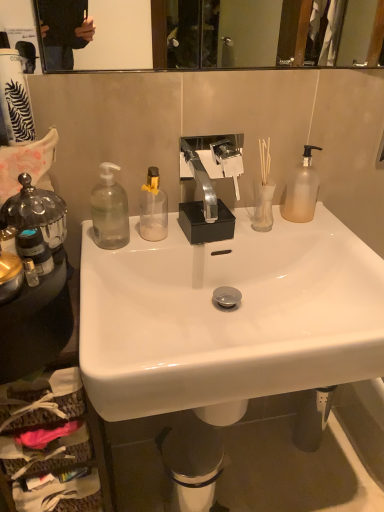
Measure the distance between transparent glass bottle at center, which ranks as the second bottle in right-to-left order, and camera.

34.86 inches.

The width and height of the screenshot is (384, 512). What do you see at coordinates (153, 208) in the screenshot? I see `transparent glass bottle at center, which ranks as the second bottle in right-to-left order` at bounding box center [153, 208].

What do you see at coordinates (227, 316) in the screenshot? This screenshot has height=512, width=384. I see `white glossy sink at center` at bounding box center [227, 316].

Where is `white matte toilet paper at upper left`? The width and height of the screenshot is (384, 512). white matte toilet paper at upper left is located at coordinates (15, 99).

You are a GUI agent. You are given a task and a screenshot of the screen. Output one action in this format:
    pyautogui.click(x=<x>, y=<y>)
    Task: Click on the translucent glass vase at center
    Image resolution: width=384 pixels, height=512 pixels.
    Given the screenshot: What is the action you would take?
    pyautogui.click(x=263, y=207)

Is point (161, 191) behind point (268, 187)?

No, it is in front of (268, 187).

Is transparent glass bottle at center, which ranks as the second bottle in right-to-left order, behind translucent glass vase at center?

No, transparent glass bottle at center, which ranks as the second bottle in right-to-left order, is closer to the viewer.

Is the surface of transparent glass bottle at center, the second bottle in the left-to-right sequence, in direct contact with translucent glass vase at center?

transparent glass bottle at center, the second bottle in the left-to-right sequence, and translucent glass vase at center are clearly separated.

Is white matte toilet paper at upper left looking in the opposite direction of frosted glass pump bottle at upper right, the 3th bottle from the left?

No.

Which is behind, white matte toilet paper at upper left or frosted glass pump bottle at upper right, the 3th bottle from the left?

frosted glass pump bottle at upper right, the 3th bottle from the left, is further from the camera.

Considering the positions of point (5, 83) and point (290, 173), is point (5, 83) closer or farther from the camera than point (290, 173)?

Point (5, 83) appears to be closer to the viewer than point (290, 173).

Does white matte toilet paper at upper left have a smaller size compared to frosted glass pump bottle at upper right, which ranks as the 1th bottle in right-to-left order?

Yes.

From the image's perspective, which is below, frosted glass pump bottle at upper right, the 3th bottle from the left, or metallic trash bin at lower center?

metallic trash bin at lower center, from the image's perspective.

Is frosted glass pump bottle at upper right, the 3th bottle from the left, bigger than metallic trash bin at lower center?

No, frosted glass pump bottle at upper right, the 3th bottle from the left, is not bigger than metallic trash bin at lower center.

The width and height of the screenshot is (384, 512). Find the location of `bottle on the right of metallic trash bin at lower center`. bottle on the right of metallic trash bin at lower center is located at coordinates [302, 190].

Is frosted glass pump bottle at upper right, the 3th bottle from the left, beside metallic trash bin at lower center?

frosted glass pump bottle at upper right, the 3th bottle from the left, and metallic trash bin at lower center are clearly separated.

From the image's perspective, relative to transparent glass bottle at center, which ranks as the second bottle in right-to-left order, is metallic trash bin at lower center above or below?

metallic trash bin at lower center is situated lower than transparent glass bottle at center, which ranks as the second bottle in right-to-left order, in the image.

Could transparent glass bottle at center, the second bottle in the left-to-right sequence, be considered to be inside metallic trash bin at lower center?

Answer: No, transparent glass bottle at center, the second bottle in the left-to-right sequence, is located outside of metallic trash bin at lower center.

Is metallic trash bin at lower center shorter than transparent glass bottle at center, the second bottle in the left-to-right sequence?

No.

Consider the image. What's the angular difference between metallic trash bin at lower center and transparent glass bottle at center, which ranks as the second bottle in right-to-left order,'s facing directions?

13.1 degrees.

From the image's perspective, which one is positioned lower, frosted glass pump bottle at upper right, the 3th bottle from the left, or translucent glass vase at center?

From the image's view, translucent glass vase at center is below.

What's the angular difference between frosted glass pump bottle at upper right, which ranks as the 1th bottle in right-to-left order, and translucent glass vase at center's facing directions?

0.00258 degrees.

Is point (311, 183) positioned in front of point (268, 207)?

Yes.

Is white glossy sink at center wider than metallic trash bin at lower center?

Indeed, white glossy sink at center has a greater width compared to metallic trash bin at lower center.

Is white glossy sink at center taller than metallic trash bin at lower center?

Indeed, white glossy sink at center has a greater height compared to metallic trash bin at lower center.

Is point (129, 405) less distant than point (208, 460)?

Yes, point (129, 405) is closer to viewer.

From a real-world perspective, which is physically above, transparent plastic soap dispenser at left, marked as the 1th bottle in a left-to-right arrangement, or white glossy sink at center?

In real-world perspective, transparent plastic soap dispenser at left, marked as the 1th bottle in a left-to-right arrangement, is above.

This screenshot has width=384, height=512. I want to click on sink lying below the transparent plastic soap dispenser at left, the third bottle in the right-to-left sequence (from the image's perspective), so click(x=227, y=316).

Measure the distance from transparent plastic soap dispenser at left, marked as the 1th bottle in a left-to-right arrangement, to white glossy sink at center.

transparent plastic soap dispenser at left, marked as the 1th bottle in a left-to-right arrangement, and white glossy sink at center are 10.81 inches apart.

Does point (112, 223) lie in front of point (234, 284)?

Yes, point (112, 223) is closer to viewer.

Locate an element on the screen. The image size is (384, 512). bottle that is the 1st one above the translucent glass vase at center (from a real-world perspective) is located at coordinates (153, 208).

From a real-world perspective, which bottle is the 1st one underneath the white matte toilet paper at upper left? Please provide its 2D coordinates.

[(302, 190)]

Which object lies nearer to the anchor point white matte toilet paper at upper left, metallic trash bin at lower center or white glossy sink at center?

white glossy sink at center is closer to white matte toilet paper at upper left.

Which object lies further to the anchor point transparent plastic soap dispenser at left, the third bottle in the right-to-left sequence, translucent glass vase at center or transparent glass bottle at center, the second bottle in the left-to-right sequence?

The object further to transparent plastic soap dispenser at left, the third bottle in the right-to-left sequence, is translucent glass vase at center.

From the image, which object appears to be nearer to translucent glass vase at center, transparent glass bottle at center, the second bottle in the left-to-right sequence, or white glossy sink at center?

The object closer to translucent glass vase at center is transparent glass bottle at center, the second bottle in the left-to-right sequence.

When comparing their distances from translucent glass vase at center, does metallic trash bin at lower center or white glossy sink at center seem closer?

white glossy sink at center.

Estimate the real-world distances between objects in this image. Which object is closer to metallic trash bin at lower center, white matte toilet paper at upper left or transparent plastic soap dispenser at left, marked as the 1th bottle in a left-to-right arrangement?

Among the two, transparent plastic soap dispenser at left, marked as the 1th bottle in a left-to-right arrangement, is located nearer to metallic trash bin at lower center.

Based on their spatial positions, is frosted glass pump bottle at upper right, which ranks as the 1th bottle in right-to-left order, or white glossy sink at center further from white matte toilet paper at upper left?

frosted glass pump bottle at upper right, which ranks as the 1th bottle in right-to-left order, is positioned further to the anchor white matte toilet paper at upper left.

Based on their spatial positions, is transparent glass bottle at center, which ranks as the second bottle in right-to-left order, or transparent plastic soap dispenser at left, the third bottle in the right-to-left sequence, further from frosted glass pump bottle at upper right, the 3th bottle from the left?

Based on the image, transparent plastic soap dispenser at left, the third bottle in the right-to-left sequence, appears to be further to frosted glass pump bottle at upper right, the 3th bottle from the left.

When comparing their distances from transparent plastic soap dispenser at left, marked as the 1th bottle in a left-to-right arrangement, does white glossy sink at center or frosted glass pump bottle at upper right, the 3th bottle from the left, seem closer?

white glossy sink at center.

Where is `sink between translucent glass vase at center and metallic trash bin at lower center in the vertical direction`? This screenshot has width=384, height=512. sink between translucent glass vase at center and metallic trash bin at lower center in the vertical direction is located at coordinates (227, 316).

Identify the location of vase that lies between white matte toilet paper at upper left and metallic trash bin at lower center from top to bottom. pyautogui.click(x=263, y=207).

Locate an element on the screen. sink between transparent plastic soap dispenser at left, marked as the 1th bottle in a left-to-right arrangement, and metallic trash bin at lower center vertically is located at coordinates click(227, 316).

Identify the location of sink between transparent glass bottle at center, the second bottle in the left-to-right sequence, and metallic trash bin at lower center in the up-down direction. (227, 316).